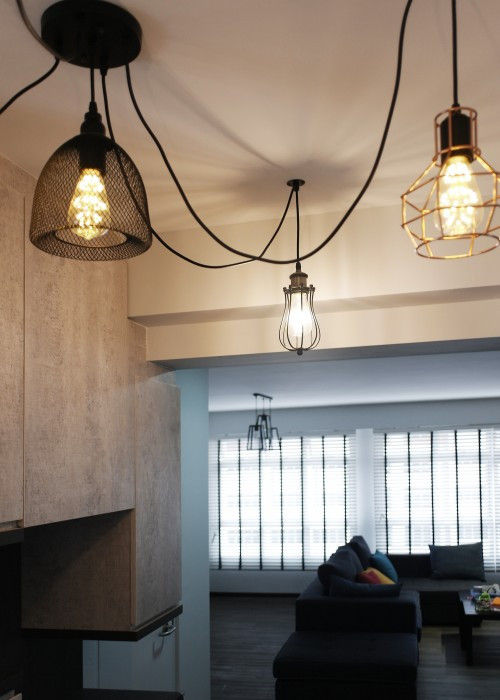
Locate an element on the screen. This screenshot has width=500, height=700. dark yellow scatter cushion is located at coordinates (375, 578).